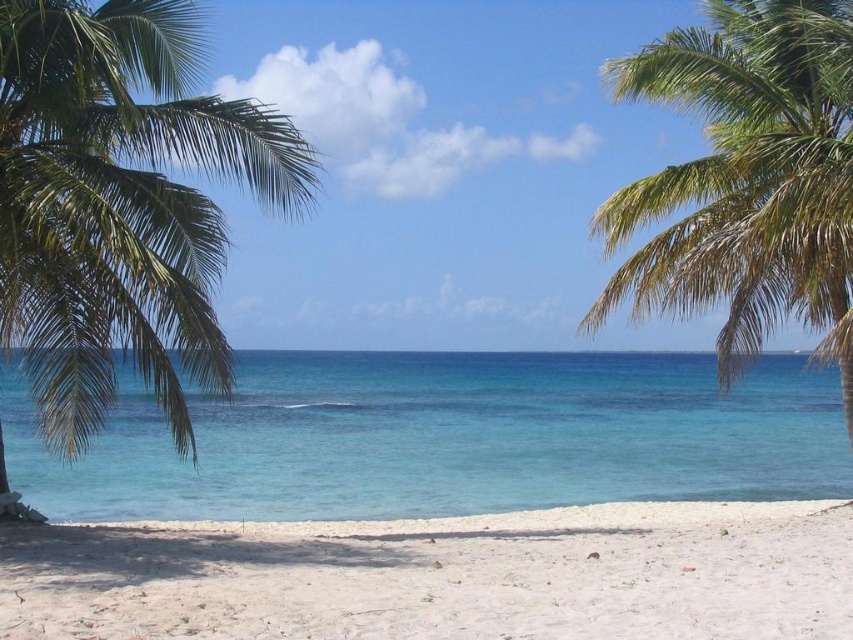
Which of these two, clear blue water at center or green leafy palm tree at right, stands taller?

green leafy palm tree at right is taller.

Between clear blue water at center and green leafy palm tree at right, which one appears on the left side from the viewer's perspective?

clear blue water at center is more to the left.

At what (x,y) coordinates should I click in order to perform the action: click on clear blue water at center. Please return your answer as a coordinate pair (x, y). Looking at the image, I should click on (445, 436).

Is point (56, 525) positioned in front of point (810, 168)?

Yes.

Is point (598, 568) farther from viewer compared to point (828, 282)?

That is False.

I want to click on white sandy beach at lower center, so click(442, 576).

What are the coordinates of `white sandy beach at lower center` in the screenshot? It's located at (442, 576).

Can you confirm if green leafy palm tree at left is taller than green leafy palm tree at right?

Correct, green leafy palm tree at left is much taller as green leafy palm tree at right.

Is green leafy palm tree at left smaller than green leafy palm tree at right?

Incorrect, green leafy palm tree at left is not smaller in size than green leafy palm tree at right.

You are a GUI agent. You are given a task and a screenshot of the screen. Output one action in this format:
    pyautogui.click(x=<x>, y=<y>)
    Task: Click on the green leafy palm tree at left
    Image resolution: width=853 pixels, height=640 pixels.
    Given the screenshot: What is the action you would take?
    pyautogui.click(x=120, y=204)